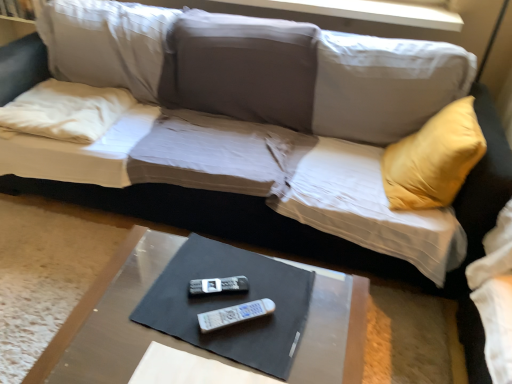
Question: From a real-world perspective, is white fabric pillow at left above or below smooth brown table at lower center?

Choices:
 (A) below
 (B) above

Answer: (B)

Question: From the image's perspective, is white fabric pillow at left above or below smooth brown table at lower center?

Choices:
 (A) below
 (B) above

Answer: (B)

Question: Based on their relative distances, which object is nearer to the black plastic remote at center, which is the 2th remote in front-to-back order?

Choices:
 (A) white plastic remote at center, positioned as the 2th remote in top-to-bottom order
 (B) smooth brown table at lower center
 (C) white fabric pillow at left

Answer: (A)

Question: Which is nearer to the white fabric pillow at left?

Choices:
 (A) white plastic remote at center, the first remote ordered from the bottom
 (B) smooth brown table at lower center
 (C) black plastic remote at center, which is the first remote from top to bottom

Answer: (B)